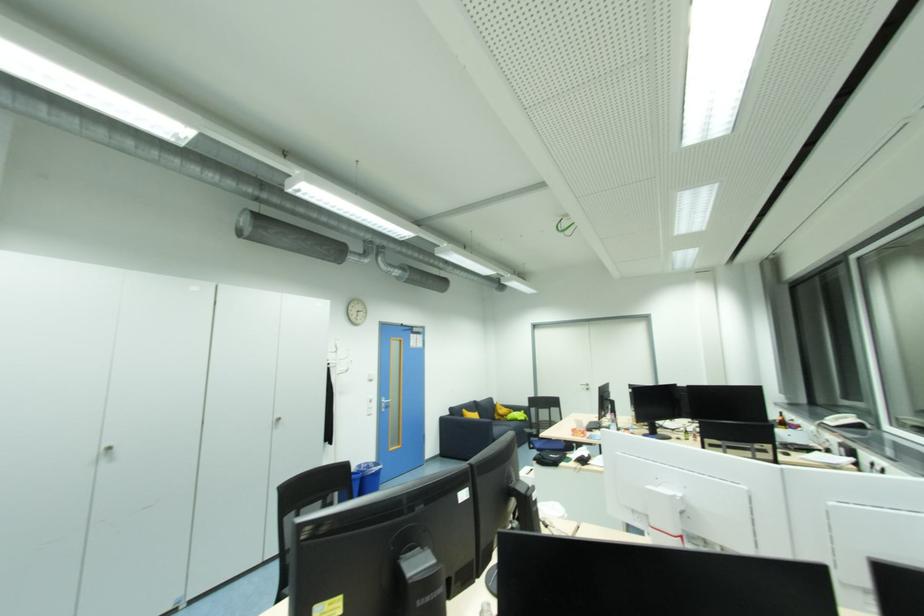
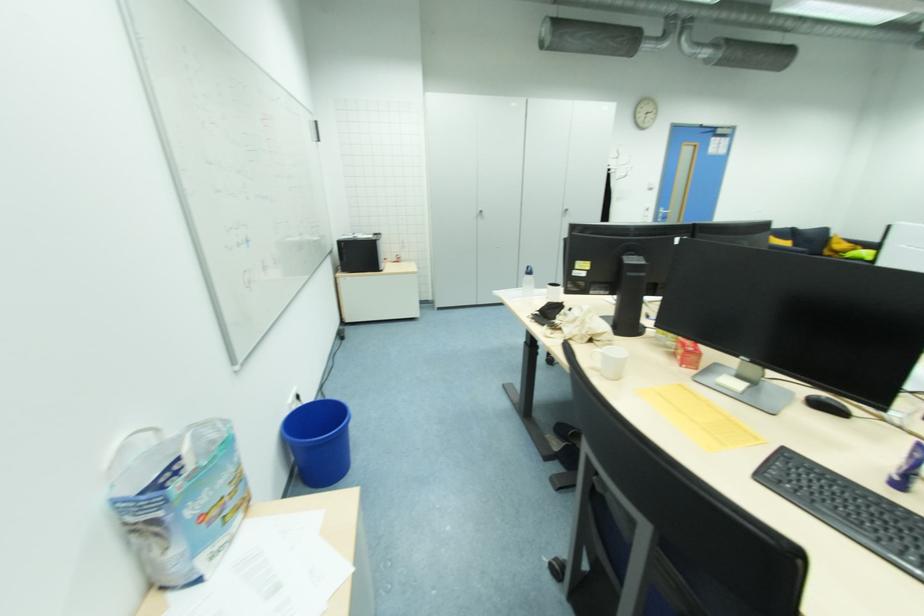
How did the camera likely rotate?

The rotation direction of the camera is left-down.